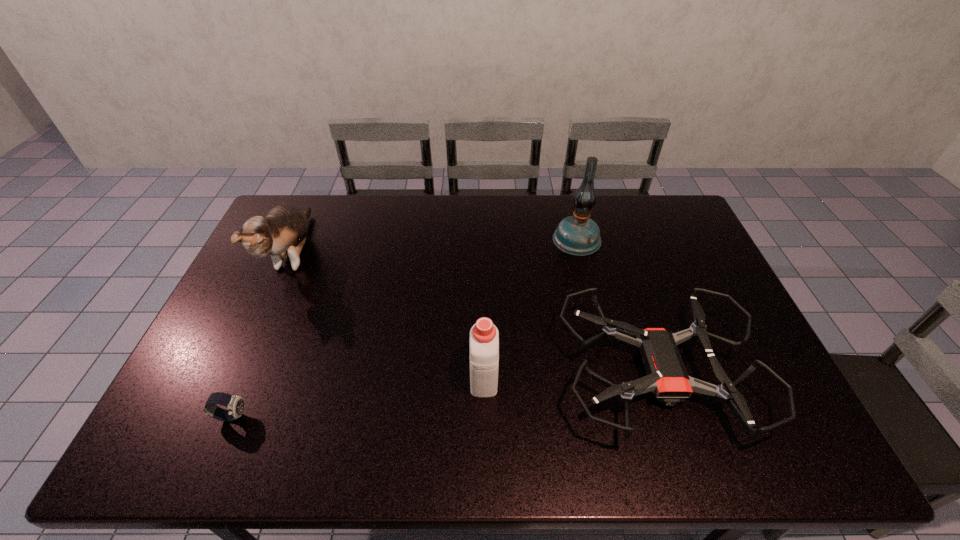
The image size is (960, 540). Identify the location of empty space that is in between the cat and the fourth tallest object. (475, 314).

The image size is (960, 540). Identify the location of unoccupied position between the detergent and the drone. (570, 373).

In order to click on free spot between the cat and the detergent in this screenshot , I will do `click(389, 314)`.

What are the coordinates of `free space between the cat and the third object from left to right` in the screenshot? It's located at (389, 314).

The image size is (960, 540). I want to click on free space between the fourth tallest object and the shortest object, so click(444, 395).

This screenshot has width=960, height=540. I want to click on free space between the detergent and the oil lamp, so pos(530,306).

I want to click on vacant region between the drone and the watch, so click(444, 395).

At what (x,y) coordinates should I click in order to perform the action: click on vacant point located between the third object from right to left and the cat. Please return your answer as a coordinate pair (x, y). The width and height of the screenshot is (960, 540). Looking at the image, I should click on (389, 314).

You are a GUI agent. You are given a task and a screenshot of the screen. Output one action in this format:
    pyautogui.click(x=<x>, y=<y>)
    Task: Click on the free space between the fourth tallest object and the third object from right to left
    This screenshot has width=960, height=540.
    Given the screenshot: What is the action you would take?
    pyautogui.click(x=570, y=373)

Point out which object is positioned as the second nearest to the second shortest object. Please provide its 2D coordinates. Your answer should be formatted as a tuple, i.e. [(x, y)], where the tuple contains the x and y coordinates of a point satisfying the conditions above.

[(579, 235)]